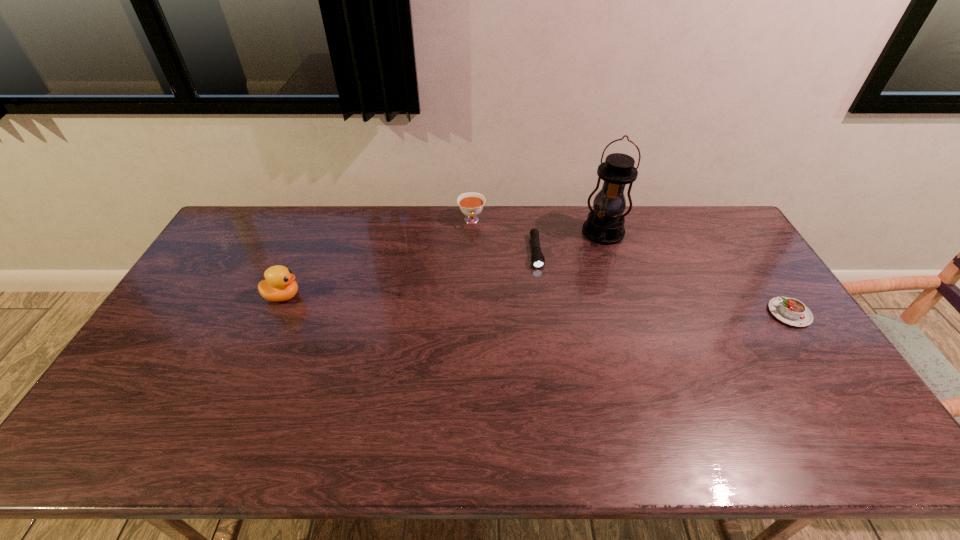
At what (x,y) coordinates should I click in order to perform the action: click on lantern that is positioned at the far edge. Please return your answer as a coordinate pair (x, y). Looking at the image, I should click on (605, 223).

Locate an element on the screen. This screenshot has width=960, height=540. teacup positioned at the far edge is located at coordinates [x=471, y=204].

Where is `object that is at the right edge`? object that is at the right edge is located at coordinates (791, 311).

You are a GUI agent. You are given a task and a screenshot of the screen. Output one action in this format:
    pyautogui.click(x=<x>, y=<y>)
    Task: Click on the free space at the far edge of the desktop
    This screenshot has height=540, width=960.
    Given the screenshot: What is the action you would take?
    pyautogui.click(x=306, y=238)

In the image, there is a desktop. Identify the location of vacant space at the near edge. (212, 411).

Locate an element on the screen. Image resolution: width=960 pixels, height=540 pixels. free spot at the far left corner of the desktop is located at coordinates (265, 226).

Locate an element on the screen. This screenshot has width=960, height=540. free point at the far right corner is located at coordinates (706, 245).

Where is `free area in between the leftmost object and the pudding`? free area in between the leftmost object and the pudding is located at coordinates (536, 305).

The image size is (960, 540). What are the coordinates of `free space between the second tallest object and the rightmost object` in the screenshot? It's located at (536, 305).

Find the location of a particular element. The image size is (960, 540). unoccupied position between the flashlight and the leftmost object is located at coordinates (409, 274).